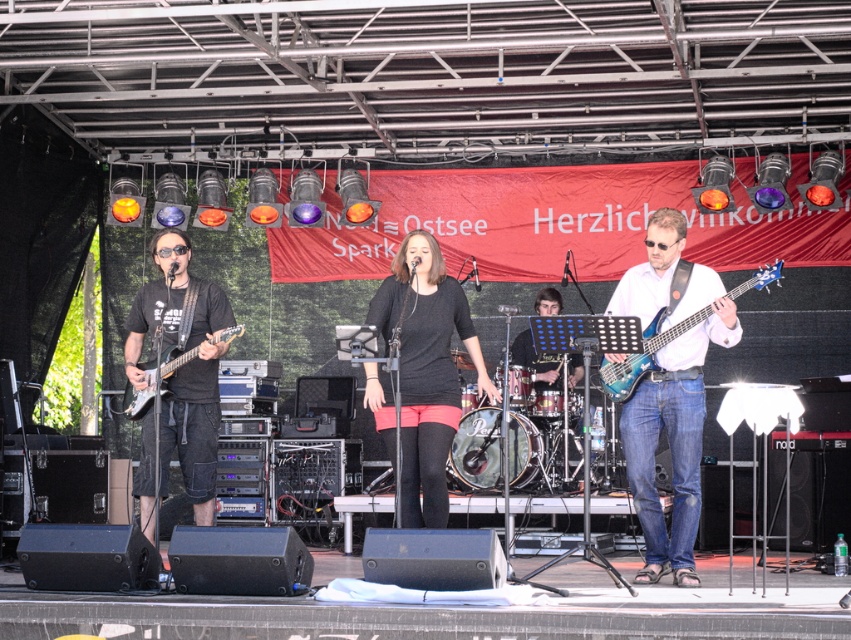
Can you confirm if blue glossy bass guitar at right is bigger than translucent blue bass at center?

Yes.

The width and height of the screenshot is (851, 640). What do you see at coordinates (674, 429) in the screenshot?
I see `blue glossy bass guitar at right` at bounding box center [674, 429].

You are a GUI agent. You are given a task and a screenshot of the screen. Output one action in this format:
    pyautogui.click(x=<x>, y=<y>)
    Task: Click on the blue glossy bass guitar at right
    The height and width of the screenshot is (640, 851).
    Given the screenshot: What is the action you would take?
    pyautogui.click(x=674, y=429)

Is the position of blue glossy bass guitar at right more distant than that of black matte shirt at center?

No, it is not.

I want to click on blue glossy bass guitar at right, so click(674, 429).

Does matte black guitar at left have a larger size compared to matte black electric guitar at left?

Indeed, matte black guitar at left has a larger size compared to matte black electric guitar at left.

Can you confirm if matte black guitar at left is positioned below matte black electric guitar at left?

Correct, matte black guitar at left is located below matte black electric guitar at left.

Who is more distant from viewer, [167,284] or [186,356]?

The point [167,284] is more distant.

Locate an element on the screen. The height and width of the screenshot is (640, 851). matte black guitar at left is located at coordinates (178, 378).